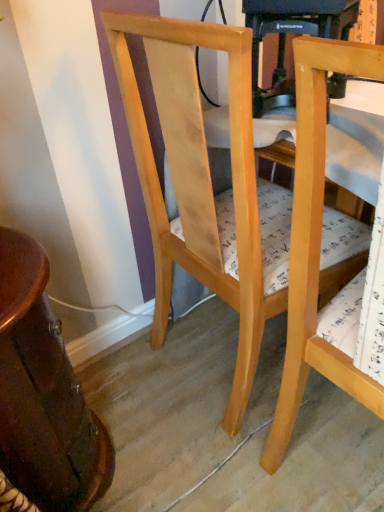
Find the location of a particular element. light wood chair at center, which is the 1th chair in left-to-right order is located at coordinates [x=200, y=181].

The image size is (384, 512). What do you see at coordinates (318, 253) in the screenshot?
I see `natural wood chair at right, acting as the second chair starting from the left` at bounding box center [318, 253].

The height and width of the screenshot is (512, 384). I want to click on light wood chair at center, which is the 1th chair in left-to-right order, so 200,181.

Is natural wood chair at right, the first chair viewed from the right, shorter than wooden table at left?

No.

Between natural wood chair at right, the first chair viewed from the right, and wooden table at left, which one has smaller width?

With smaller width is wooden table at left.

Can you confirm if natural wood chair at right, the first chair viewed from the right, is positioned to the left of wooden table at left?

In fact, natural wood chair at right, the first chair viewed from the right, is to the right of wooden table at left.

Who is more distant, natural wood chair at right, acting as the second chair starting from the left, or wooden table at left?

wooden table at left is behind.

Considering the relative sizes of light wood chair at center, which is the 1th chair in left-to-right order, and wooden table at left in the image provided, is light wood chair at center, which is the 1th chair in left-to-right order, smaller than wooden table at left?

Actually, light wood chair at center, which is the 1th chair in left-to-right order, might be larger than wooden table at left.

From a real-world perspective, which object stands above the other?

From a 3D spatial view, light wood chair at center, which is the second chair in right-to-left order, is above.

Is light wood chair at center, which is the second chair in right-to-left order, facing towards wooden table at left?

No, light wood chair at center, which is the second chair in right-to-left order, does not turn towards wooden table at left.

Looking at this image, which of these two, light wood chair at center, which is the second chair in right-to-left order, or natural wood chair at right, the first chair viewed from the right, stands taller?

Standing taller between the two is natural wood chair at right, the first chair viewed from the right.

This screenshot has width=384, height=512. In order to click on chair on the right of light wood chair at center, which is the 1th chair in left-to-right order in this screenshot , I will do `click(318, 253)`.

How far apart are light wood chair at center, which is the 1th chair in left-to-right order, and natural wood chair at right, the first chair viewed from the right?

light wood chair at center, which is the 1th chair in left-to-right order, and natural wood chair at right, the first chair viewed from the right, are 9.36 inches apart.

Considering the sizes of light wood chair at center, which is the 1th chair in left-to-right order, and natural wood chair at right, the first chair viewed from the right, in the image, is light wood chair at center, which is the 1th chair in left-to-right order, wider or thinner than natural wood chair at right, the first chair viewed from the right,?

light wood chair at center, which is the 1th chair in left-to-right order, is wider than natural wood chair at right, the first chair viewed from the right.

Which of these two, wooden table at left or light wood chair at center, which is the second chair in right-to-left order, stands taller?

light wood chair at center, which is the second chair in right-to-left order.

From the image's perspective, which object appears higher, wooden table at left or light wood chair at center, which is the 1th chair in left-to-right order?

From the image's view, light wood chair at center, which is the 1th chair in left-to-right order, is above.

In the scene shown: What's the angular difference between wooden table at left and light wood chair at center, which is the second chair in right-to-left order,'s facing directions?

They differ by 1.07 degrees in their facing directions.

From a real-world perspective, is wooden table at left positioned under light wood chair at center, which is the second chair in right-to-left order, based on gravity?

Indeed, from a real-world perspective, wooden table at left is positioned beneath light wood chair at center, which is the second chair in right-to-left order.

Based on the photo, is natural wood chair at right, the first chair viewed from the right, in front of or behind light wood chair at center, which is the second chair in right-to-left order, in the image?

natural wood chair at right, the first chair viewed from the right, is positioned closer to the viewer than light wood chair at center, which is the second chair in right-to-left order.

Considering the relative sizes of natural wood chair at right, the first chair viewed from the right, and light wood chair at center, which is the second chair in right-to-left order, in the image provided, is natural wood chair at right, the first chair viewed from the right, thinner than light wood chair at center, which is the second chair in right-to-left order,?

Yes.

The width and height of the screenshot is (384, 512). I want to click on chair that appears on the right of light wood chair at center, which is the 1th chair in left-to-right order, so click(318, 253).

Could natural wood chair at right, acting as the second chair starting from the left, be considered to be inside wooden table at left?

Actually, natural wood chair at right, acting as the second chair starting from the left, is outside wooden table at left.

From the image's perspective, does wooden table at left appear lower than natural wood chair at right, the first chair viewed from the right?

Yes, from the image's perspective, wooden table at left is below natural wood chair at right, the first chair viewed from the right.

Is wooden table at left facing away from natural wood chair at right, acting as the second chair starting from the left?

No, wooden table at left is not facing away from natural wood chair at right, acting as the second chair starting from the left.

Is point (7, 318) positioned in front of point (293, 316)?

Yes, it is.

From the image's perspective, which chair is the 1st one above the wooden table at left? Please provide its 2D coordinates.

[(318, 253)]

This screenshot has width=384, height=512. What are the coordinates of `table behind the light wood chair at center, which is the second chair in right-to-left order` in the screenshot? It's located at pos(43,393).

Looking at the image, which one is located further to natural wood chair at right, the first chair viewed from the right, light wood chair at center, which is the second chair in right-to-left order, or wooden table at left?

wooden table at left is positioned further to the anchor natural wood chair at right, the first chair viewed from the right.

Based on their spatial positions, is light wood chair at center, which is the second chair in right-to-left order, or natural wood chair at right, acting as the second chair starting from the left, closer to wooden table at left?

light wood chair at center, which is the second chair in right-to-left order, lies closer to wooden table at left than the other object.

Looking at the image, which one is located closer to natural wood chair at right, the first chair viewed from the right, wooden table at left or light wood chair at center, which is the 1th chair in left-to-right order?

Based on the image, light wood chair at center, which is the 1th chair in left-to-right order, appears to be nearer to natural wood chair at right, the first chair viewed from the right.

Looking at the image, which one is located closer to light wood chair at center, which is the 1th chair in left-to-right order, natural wood chair at right, acting as the second chair starting from the left, or wooden table at left?

natural wood chair at right, acting as the second chair starting from the left.

Consider the image. Which object lies further to the anchor point wooden table at left, natural wood chair at right, acting as the second chair starting from the left, or light wood chair at center, which is the second chair in right-to-left order?

Based on the image, natural wood chair at right, acting as the second chair starting from the left, appears to be further to wooden table at left.

In the scene shown: Estimate the real-world distances between objects in this image. Which object is further from light wood chair at center, which is the 1th chair in left-to-right order, wooden table at left or natural wood chair at right, acting as the second chair starting from the left?

wooden table at left.

Locate an element on the screen. The height and width of the screenshot is (512, 384). chair located between wooden table at left and natural wood chair at right, acting as the second chair starting from the left, in the left-right direction is located at coordinates (200, 181).